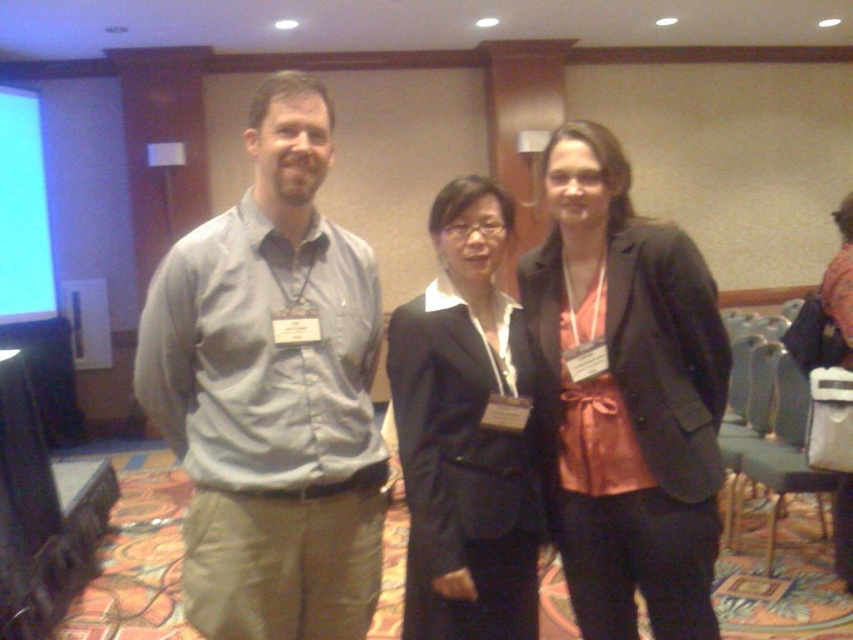
You are standing at the entrance of the room and want to approach the gray cotton shirt at center. There is a 1.5 meter wide path between you and them. Can you walk directly to them without needing to move sideways?

The gray cotton shirt at center is 1.47 meters away. The path is 1.5 meters wide, which is slightly wider than the distance to the shirt. Therefore, you can walk directly to the gray cotton shirt at center without needing to move sideways.

Please provide the 2D coordinates of the matte black blazer at center in the image. The scene shows three people in a conference setting with a beige wall and a projector screen on the left. The individuals are dressed formally, with the person on the left in a light gray shirt and khaki pants, and the middle person in a black blazer over a white shirt. The coordinates should be in the format of a point with two decimal values between 0 and 1, representing the position within the image frame.

The 2D coordinates of the matte black blazer at center are at point (625,396).

You are a photographer at this event and need to adjust the camera height to capture both the gray cotton shirt at center and the black matte suit at center in focus. Which person should you focus on first to ensure both are in frame?

The gray cotton shirt at center is taller than the black matte suit at center, so focus on the gray cotton shirt at center first to ensure the entire height range of both individuals is captured.